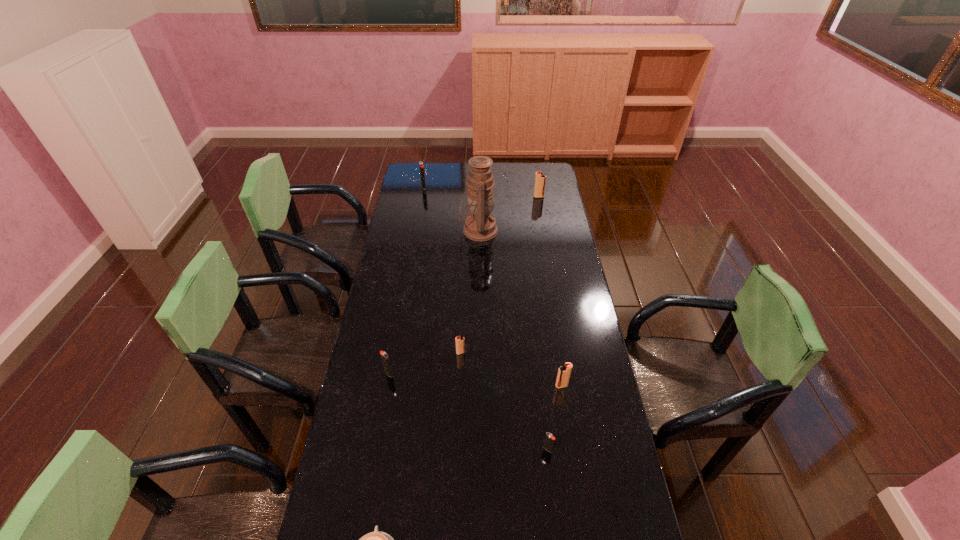
Identify the location of free space that satisfies the following two spatial constraints: 1. on the front side of the oil lamp; 2. on the left side of the biggest black igniter. (417, 231).

Find the location of a particular element. free space in the image that satisfies the following two spatial constraints: 1. on the back side of the second smallest black igniter; 2. on the left side of the tallest object is located at coordinates (414, 231).

This screenshot has height=540, width=960. What are the coordinates of `vacant point that satisfies the following two spatial constraints: 1. on the back side of the second farthest object; 2. on the right side of the nearest red igniter` in the screenshot? It's located at point(533,197).